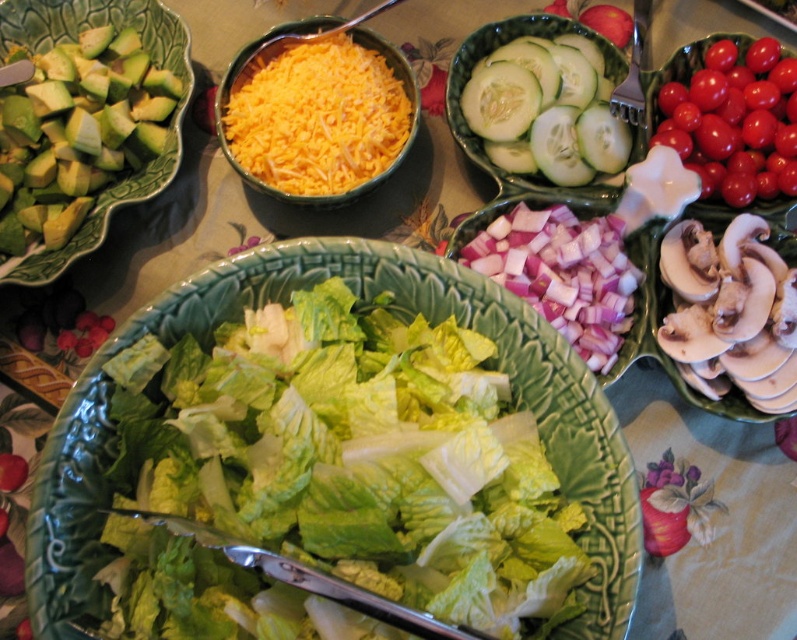
You are preparing a salad and want to know which ingredient occupies more horizontal space on the table. Which one is wider, the green leafy lettuce at center or the glossy cherry tomatoes at upper right?

The green leafy lettuce at center might be wider than glossy cherry tomatoes at upper right according to the description provided.